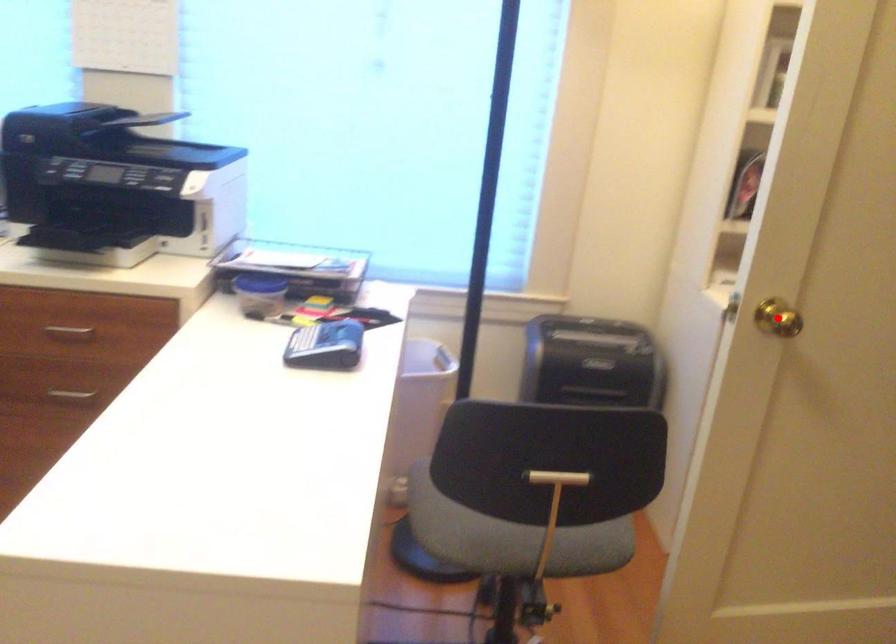
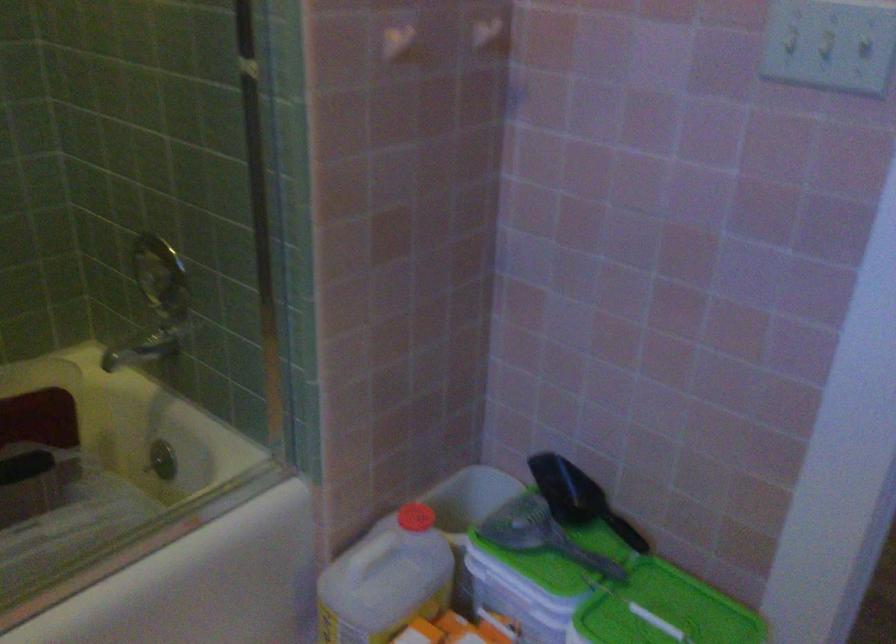
Question: I am providing you with two images of the same scene from different viewpoints. A red point is marked on the first image. Is the red point's position out of view in image 2?

Choices:
 (A) Yes
 (B) No

Answer: (A)